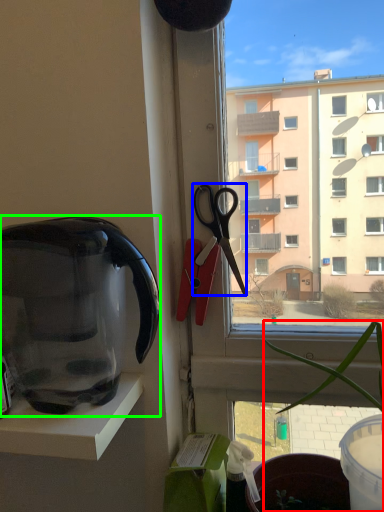
Question: Considering the real-world distances, which object is closest to houseplant (highlighted by a red box)? scissors (highlighted by a blue box) or kettle (highlighted by a green box).

Choices:
 (A) scissors
 (B) kettle

Answer: (A)